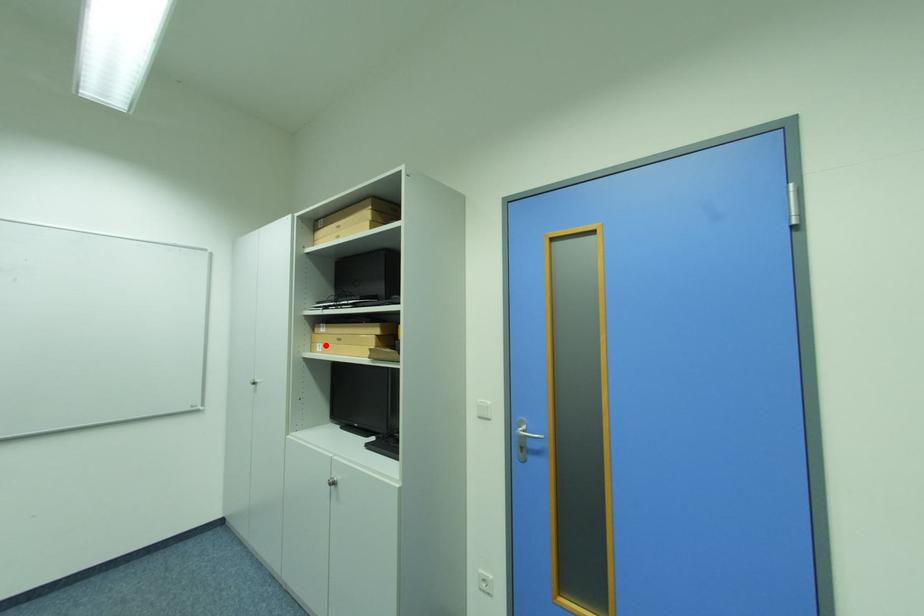
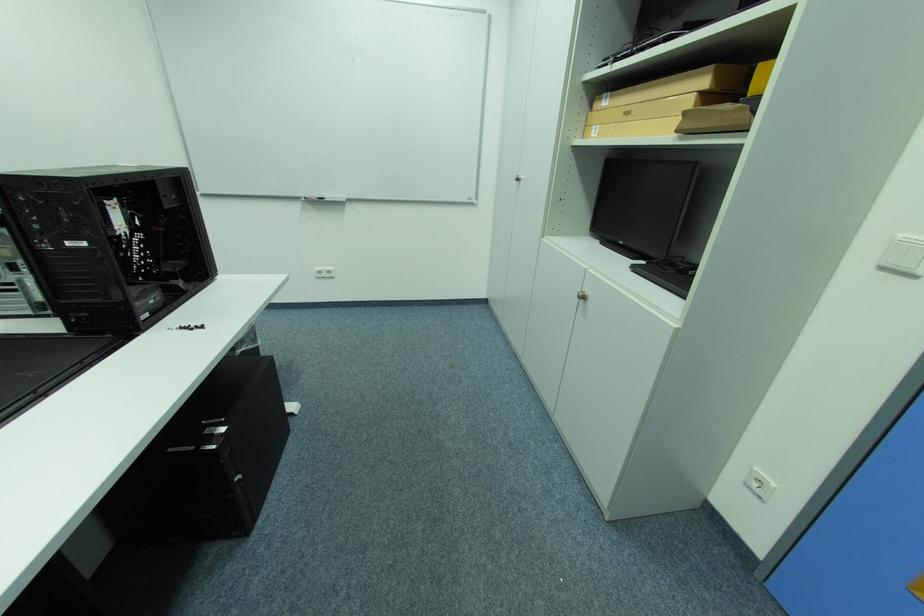
Locate, in the second image, the point that corresponds to the highlighted location in the first image.

(602, 128)